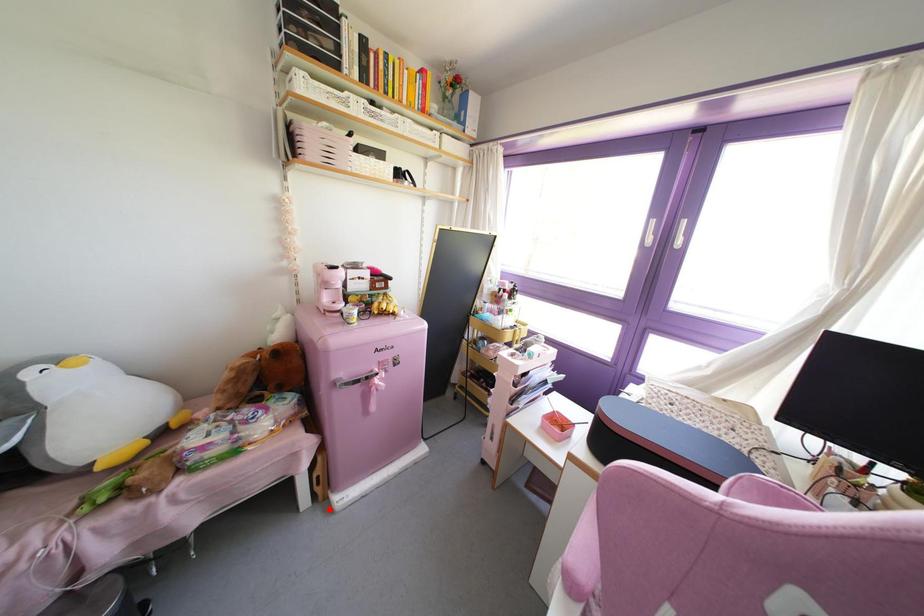
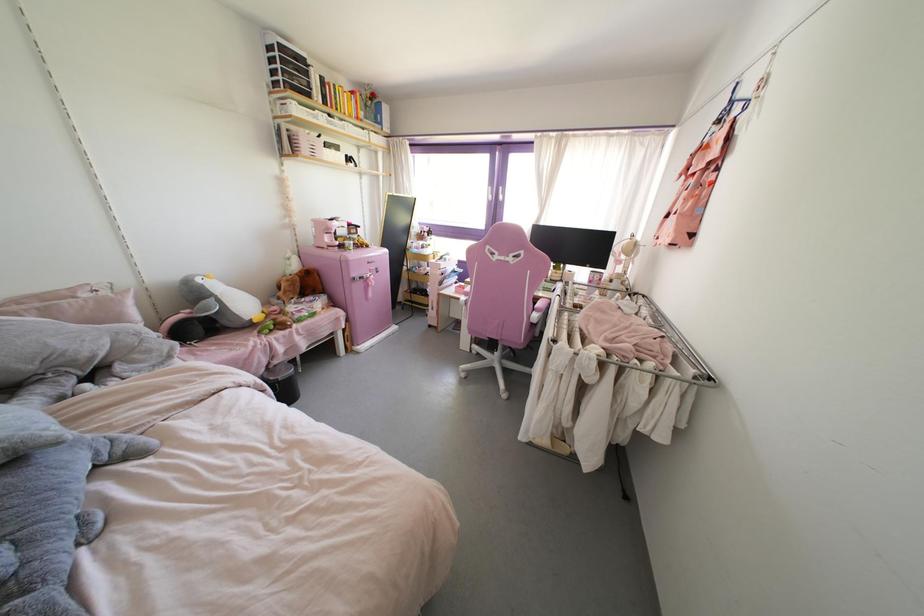
Locate, in the second image, the point that corresponds to the highlighted location in the first image.

(357, 352)